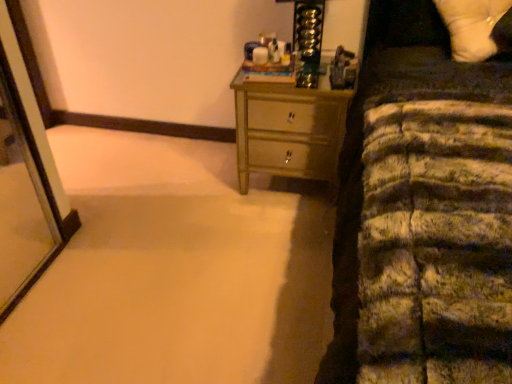
Question: From the image's perspective, is white soft pillow at upper right positioned above or below metallic gold chest of drawers at center?

Choices:
 (A) below
 (B) above

Answer: (B)

Question: In terms of height, does white soft pillow at upper right look taller or shorter compared to metallic gold chest of drawers at center?

Choices:
 (A) short
 (B) tall

Answer: (A)

Question: Is white soft pillow at upper right inside or outside of metallic gold chest of drawers at center?

Choices:
 (A) inside
 (B) outside

Answer: (B)

Question: In the image, is metallic gold chest of drawers at center positioned in front of or behind white soft pillow at upper right?

Choices:
 (A) front
 (B) behind

Answer: (B)

Question: In the image, is metallic gold chest of drawers at center on the left side or the right side of white soft pillow at upper right?

Choices:
 (A) right
 (B) left

Answer: (B)

Question: Considering the positions of point (259, 140) and point (506, 4), is point (259, 140) closer or farther from the camera than point (506, 4)?

Choices:
 (A) closer
 (B) farther

Answer: (B)

Question: Is metallic gold chest of drawers at center bigger or smaller than white soft pillow at upper right?

Choices:
 (A) big
 (B) small

Answer: (A)